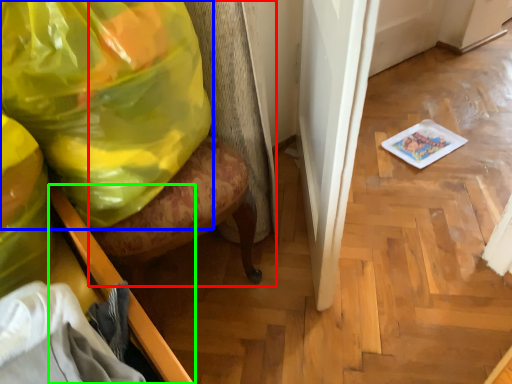
Question: Estimate the real-world distances between objects in this image. Which object is closer to swivel chair (highlighted by a red box), plastic bag (highlighted by a blue box) or furniture (highlighted by a green box)?

Choices:
 (A) plastic bag
 (B) furniture

Answer: (A)